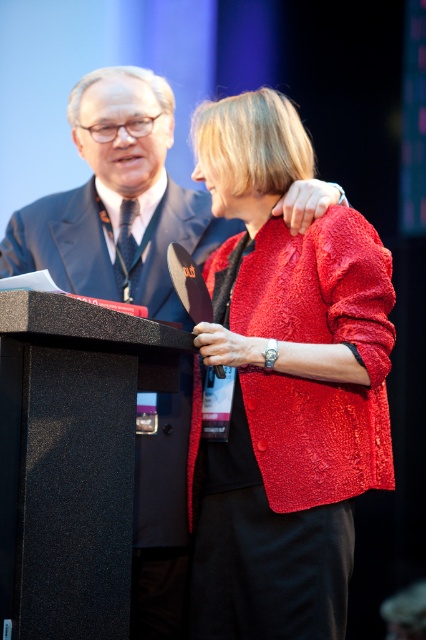
Question: Which point is closer to the camera?

Choices:
 (A) (63, 372)
 (B) (103, 218)
 (C) (377, 365)

Answer: (A)

Question: From the image, what is the correct spatial relationship of red textured jacket at center in relation to black textured podium at center?

Choices:
 (A) above
 (B) below

Answer: (A)

Question: Does black textured podium at center have a greater width compared to matte black suit at center?

Choices:
 (A) no
 (B) yes

Answer: (A)

Question: Which point appears closest to the camera in this image?

Choices:
 (A) (264, 513)
 (B) (83, 472)

Answer: (B)

Question: Is black textured podium at center thinner than matte black suit at center?

Choices:
 (A) no
 (B) yes

Answer: (B)

Question: Which point is closer to the camera?

Choices:
 (A) matte black suit at center
 (B) black textured podium at center
 (C) red textured jacket at center

Answer: (B)